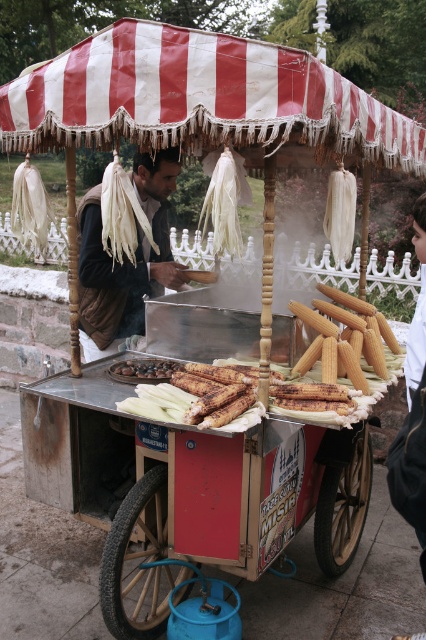
Question: Where is yellow matte corn at center located in relation to shiny dark chocolate at center in the image?

Choices:
 (A) above
 (B) below

Answer: (A)

Question: Observing the image, what is the correct spatial positioning of red and white striped canopy at upper center in reference to yellow matte corn at center?

Choices:
 (A) above
 (B) below

Answer: (A)

Question: Which object appears farthest from the camera in this image?

Choices:
 (A) shiny dark chocolate at center
 (B) red and white striped canopy at upper center

Answer: (A)

Question: Which point is farther from the camera taking this photo?

Choices:
 (A) 123,291
 (B) 359,333
 (C) 169,372

Answer: (A)

Question: Considering the relative positions of red and white striped canopy at upper center and shiny dark chocolate at center in the image provided, where is red and white striped canopy at upper center located with respect to shiny dark chocolate at center?

Choices:
 (A) above
 (B) below

Answer: (A)

Question: Which object is the farthest from the yellow matte corn at center?

Choices:
 (A) red and white striped canopy at upper center
 (B) brown leather jacket at center
 (C) shiny dark chocolate at center

Answer: (B)